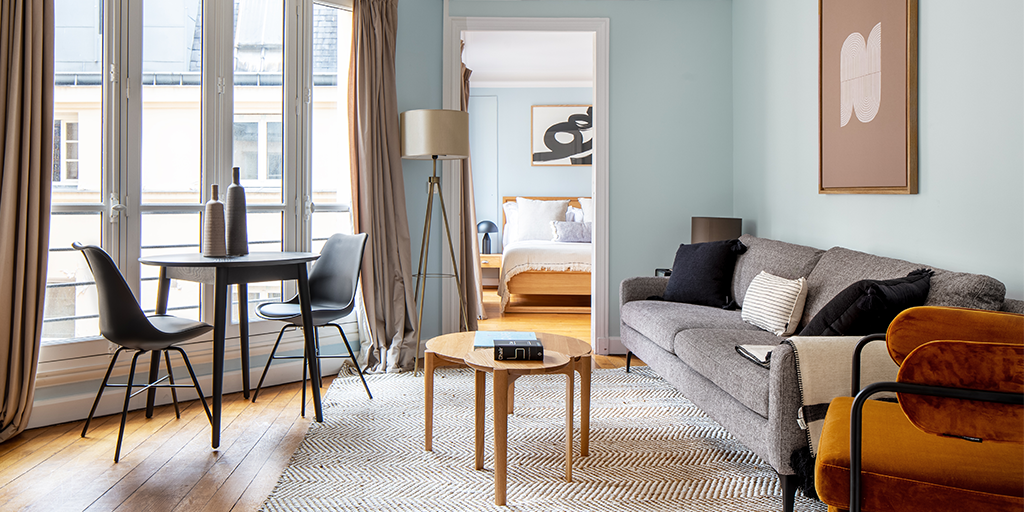
What are the coordinates of `windows` in the screenshot? It's located at (333, 130), (256, 141), (177, 145), (66, 149).